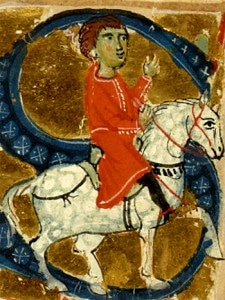
Locate an element on the screen. The height and width of the screenshot is (300, 225). chipped paint is located at coordinates (220, 287), (202, 40), (150, 14).